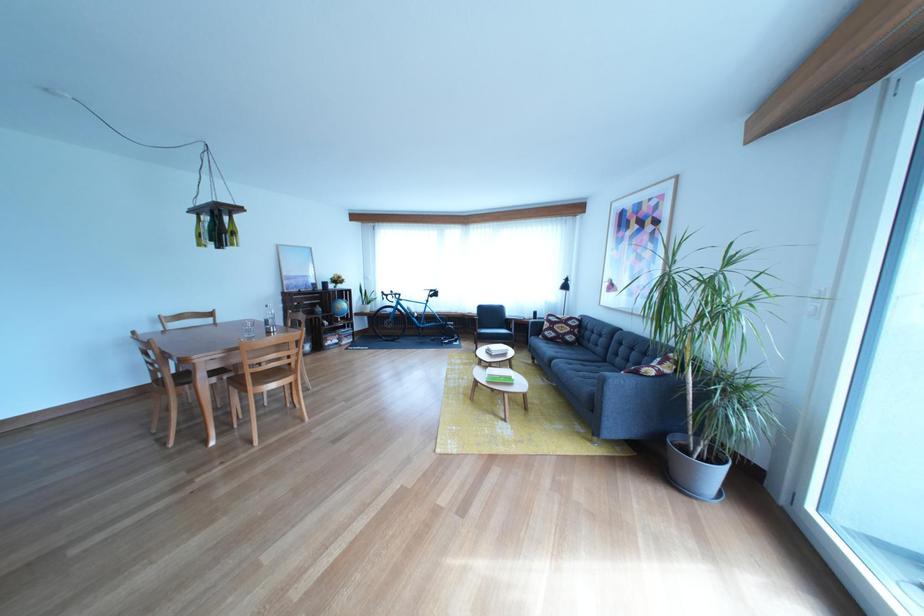
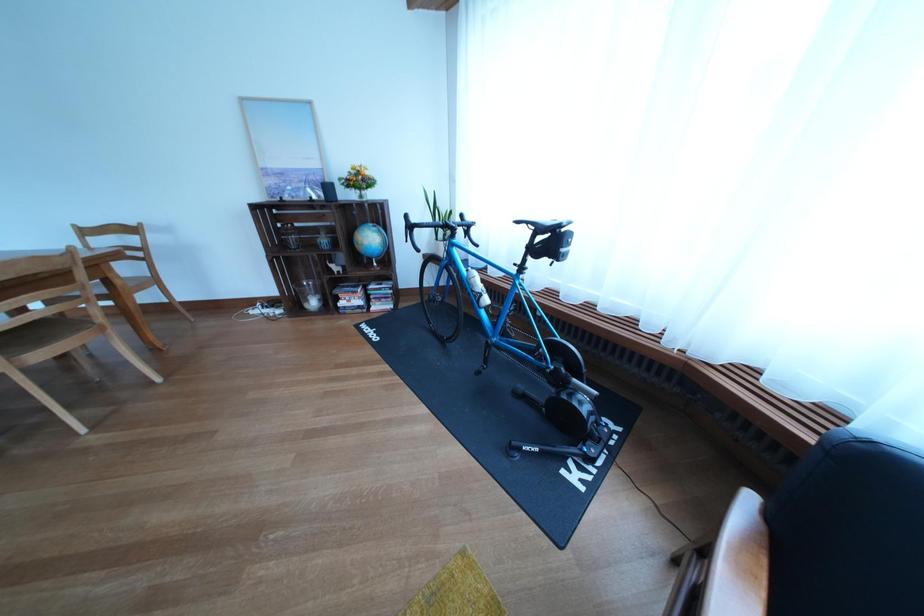
In the second image, find the point that corresponds to (350,286) in the first image.

(372, 185)